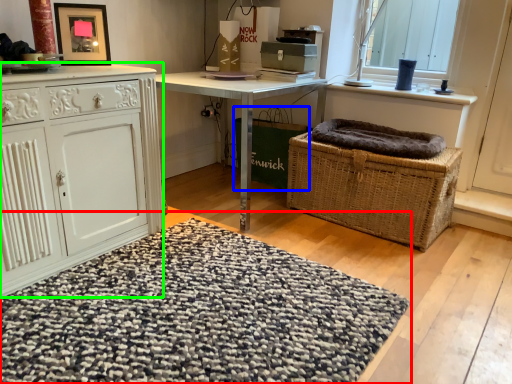
Question: Considering the real-world distances, which object is farthest from doormat (highlighted by a red box)? basket container (highlighted by a blue box) or cabinetry (highlighted by a green box)?

Choices:
 (A) basket container
 (B) cabinetry

Answer: (A)